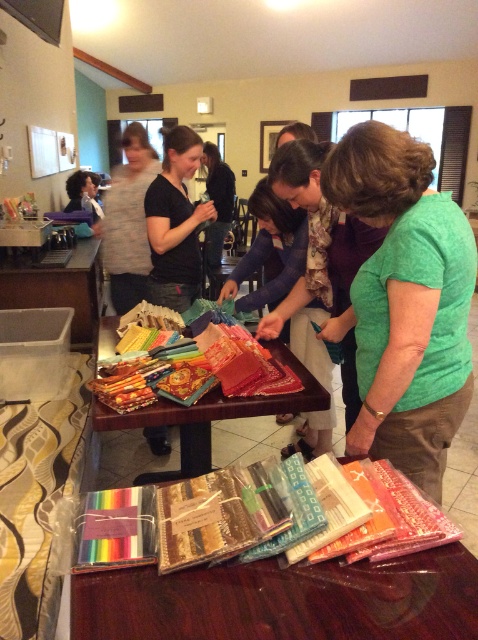
Consider the image. You are organizing a craft fair and need to arrange the shiny plastic fabric at center and the matte green shirt at center on a display table. Based on their sizes, which item should you place first to ensure proper arrangement?

The shiny plastic fabric at center is smaller than the matte green shirt at center, so you should place the matte green shirt at center first to accommodate its larger size before arranging the smaller shiny plastic fabric at center.

You are a photographer standing at the camera position. You want to take a closeup photo of the green cotton shirt at center. Can you reach it without moving the shirt or your position?

The green cotton shirt at center is 1.19 meters away from camera, so yes, you can reach it without moving the shirt or your position.

You are organizing a craft fair and need to display both the matte green shirt at center and the textured fabric at center on a vertical display board. Which item should you place higher up to ensure both are visible?

The matte green shirt at center is taller than the textured fabric at center, so placing it higher up will allow both items to be visible without one blocking the other.